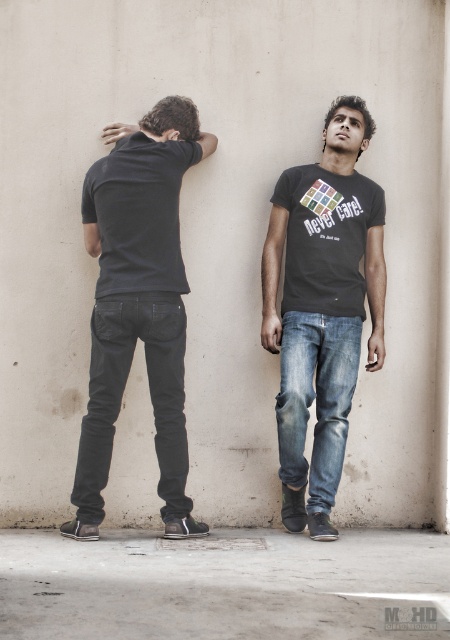
Based on the photo, you are a photographer adjusting your camera settings. You notice two points in the image at coordinates point (x=116, y=296) and point (x=328, y=392). Which point should you focus on to ensure it appears sharper in the final photo?

Point (x=116, y=296) is closer to the camera than point (x=328, y=392), so focusing on point (x=116, y=296) will ensure it appears sharper in the final photo.